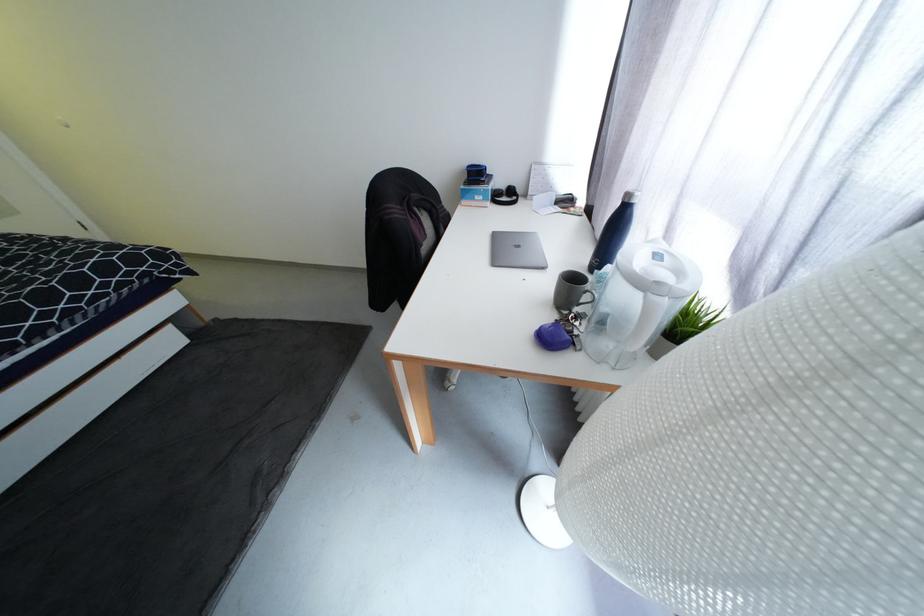
The image size is (924, 616). In order to click on pitcher lid flap in this screenshot , I will do `click(658, 268)`.